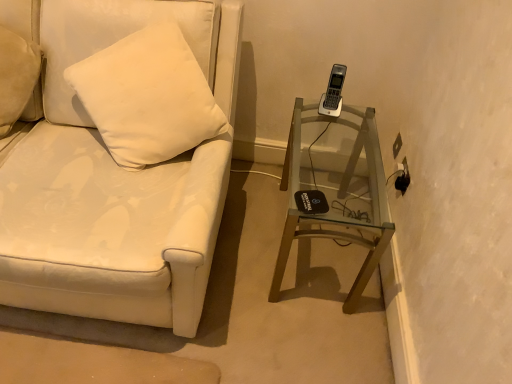
In order to face transparent glass table at lower right, should I rotate leftwards or rightwards?

To align with it, rotate right about 9.975°.

The image size is (512, 384). Describe the element at coordinates (337, 189) in the screenshot. I see `transparent glass table at lower right` at that location.

Find the location of a particular element. Image resolution: width=512 pixels, height=384 pixels. transparent glass table at lower right is located at coordinates (337, 189).

What is the approximate height of white leather couch at left?

white leather couch at left is 31.04 inches in height.

Where is `white leather couch at left`? white leather couch at left is located at coordinates (115, 185).

Describe the element at coordinates (115, 185) in the screenshot. The height and width of the screenshot is (384, 512). I see `white leather couch at left` at that location.

The height and width of the screenshot is (384, 512). Identify the location of transparent glass table at lower right. (337, 189).

Would you say white leather couch at left is to the left or to the right of transparent glass table at lower right in the picture?

white leather couch at left is to the left of transparent glass table at lower right.

Considering the positions of objects white leather couch at left and transparent glass table at lower right in the image provided, who is behind, white leather couch at left or transparent glass table at lower right?

Positioned behind is transparent glass table at lower right.

Considering the points (227, 161) and (285, 227), which point is behind, point (227, 161) or point (285, 227)?

Point (285, 227)

From the image's perspective, between white leather couch at left and transparent glass table at lower right, which one is located above?

white leather couch at left, from the image's perspective.

From a real-world perspective, between white leather couch at left and transparent glass table at lower right, who is vertically higher?

In real-world perspective, white leather couch at left is above.

Can you confirm if white leather couch at left is wider than transparent glass table at lower right?

Indeed, white leather couch at left has a greater width compared to transparent glass table at lower right.

Considering the sizes of white leather couch at left and transparent glass table at lower right in the image, is white leather couch at left taller or shorter than transparent glass table at lower right?

white leather couch at left is taller than transparent glass table at lower right.

Which of these two, white leather couch at left or transparent glass table at lower right, is smaller?

transparent glass table at lower right.

Is white leather couch at left situated inside transparent glass table at lower right or outside?

white leather couch at left is located beyond the bounds of transparent glass table at lower right.

Is white leather couch at left far from transparent glass table at lower right?

No.

Is transparent glass table at lower right at the back of white leather couch at left?

That's not correct — white leather couch at left is not looking away from transparent glass table at lower right.

From the picture: How many degrees apart are the facing directions of white leather couch at left and transparent glass table at lower right?

white leather couch at left and transparent glass table at lower right are facing 1.35 degrees away from each other.

Identify the location of furniture that is in front of the transparent glass table at lower right. Image resolution: width=512 pixels, height=384 pixels. (115, 185).

Which is more to the left, transparent glass table at lower right or white leather couch at left?

white leather couch at left.

Which object is closer to the camera, transparent glass table at lower right or white leather couch at left?

Positioned in front is white leather couch at left.

Is point (376, 174) in front of point (123, 222)?

No, it is behind (123, 222).

From the image's perspective, does transparent glass table at lower right appear lower than white leather couch at left?

Correct, transparent glass table at lower right appears lower than white leather couch at left in the image.

From a real-world perspective, is transparent glass table at lower right positioned under white leather couch at left based on gravity?

Yes, from a real-world perspective, transparent glass table at lower right is under white leather couch at left.

Does transparent glass table at lower right have a lesser width compared to white leather couch at left?

Correct, the width of transparent glass table at lower right is less than that of white leather couch at left.

Who is shorter, transparent glass table at lower right or white leather couch at left?

Standing shorter between the two is transparent glass table at lower right.

Looking at this image, who is smaller, transparent glass table at lower right or white leather couch at left?

transparent glass table at lower right.

Is transparent glass table at lower right inside or outside of white leather couch at left?

transparent glass table at lower right cannot be found inside white leather couch at left.

Is transparent glass table at lower right next to white leather couch at left?

No, transparent glass table at lower right is not beside white leather couch at left.

Is transparent glass table at lower right aimed at white leather couch at left?

No, transparent glass table at lower right is not oriented towards white leather couch at left.

How far apart are transparent glass table at lower right and white leather couch at left?

A distance of 21.85 inches exists between transparent glass table at lower right and white leather couch at left.

Image resolution: width=512 pixels, height=384 pixels. I want to click on furniture on the left of the transparent glass table at lower right, so click(x=115, y=185).

Where is `furniture in front of the transparent glass table at lower right`? Image resolution: width=512 pixels, height=384 pixels. furniture in front of the transparent glass table at lower right is located at coordinates (115, 185).

Locate an element on the screen. The width and height of the screenshot is (512, 384). table behind the white leather couch at left is located at coordinates (337, 189).